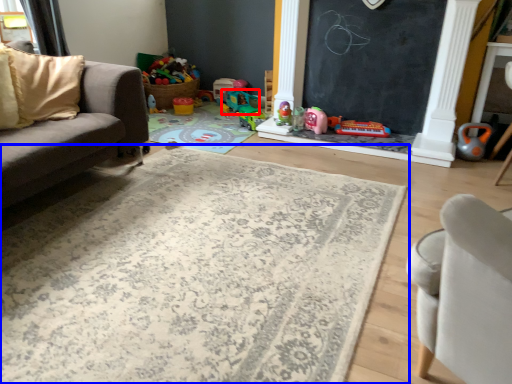
Question: Which object is further to the camera taking this photo, toy (highlighted by a red box) or mat (highlighted by a blue box)?

Choices:
 (A) toy
 (B) mat

Answer: (A)